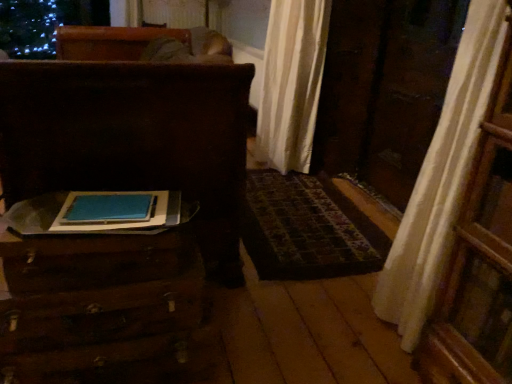
Question: From a real-world perspective, is wooden suitcase at lower left, acting as the 1th furniture starting from the bottom, above or below wooden trunk at left, acting as the 1th furniture starting from the top?

Choices:
 (A) below
 (B) above

Answer: (A)

Question: In the image, is wooden suitcase at lower left, which is the second furniture from top to bottom, on the left side or the right side of wooden trunk at left, acting as the 1th furniture starting from the top?

Choices:
 (A) left
 (B) right

Answer: (B)

Question: Is wooden suitcase at lower left, acting as the 1th furniture starting from the bottom, spatially inside wooden trunk at left, acting as the 1th furniture starting from the top, or outside of it?

Choices:
 (A) outside
 (B) inside

Answer: (A)

Question: From a real-world perspective, is wooden trunk at left, which is the second furniture in bottom-to-top order, positioned above or below wooden suitcase at lower left, acting as the 1th furniture starting from the bottom?

Choices:
 (A) below
 (B) above

Answer: (B)

Question: Based on their positions, is wooden trunk at left, acting as the 1th furniture starting from the top, located to the left or right of wooden suitcase at lower left, acting as the 1th furniture starting from the bottom?

Choices:
 (A) right
 (B) left

Answer: (B)

Question: From the image's perspective, relative to wooden suitcase at lower left, acting as the 1th furniture starting from the bottom, is wooden trunk at left, acting as the 1th furniture starting from the top, above or below?

Choices:
 (A) below
 (B) above

Answer: (B)

Question: Is wooden trunk at left, which is the second furniture in bottom-to-top order, inside or outside of wooden suitcase at lower left, which is the second furniture from top to bottom?

Choices:
 (A) outside
 (B) inside

Answer: (A)